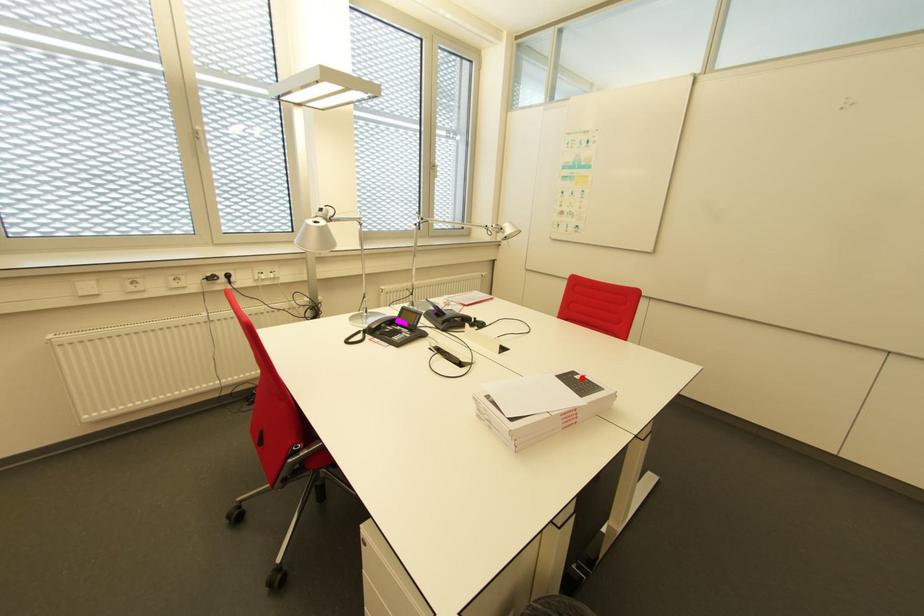
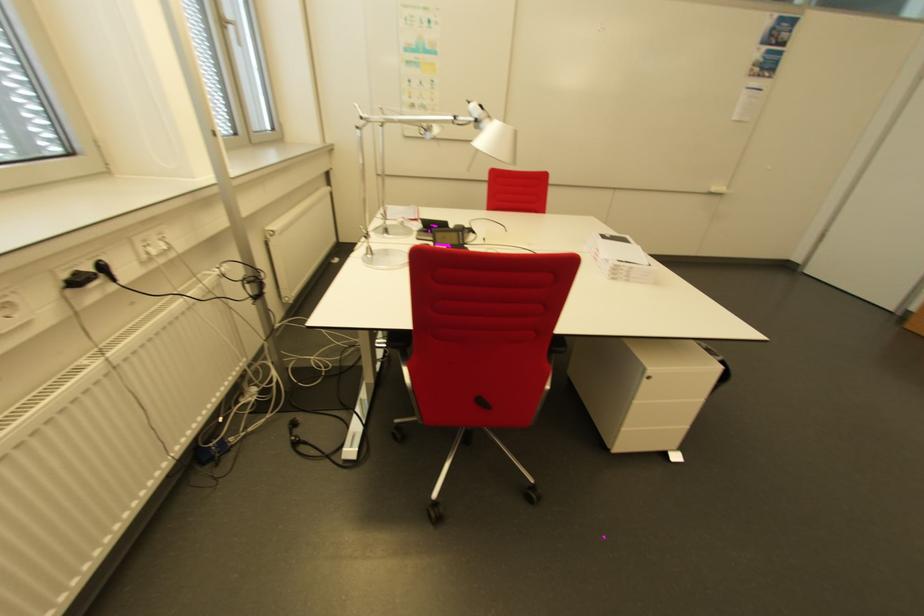
Question: A red point is marked in image1. In image2, is the corresponding 3D point closer to the camera or farther? Reply with the corresponding letter.

Choices:
 (A) The corresponding 3D point is closer.
 (B) The corresponding 3D point is farther.

Answer: (A)